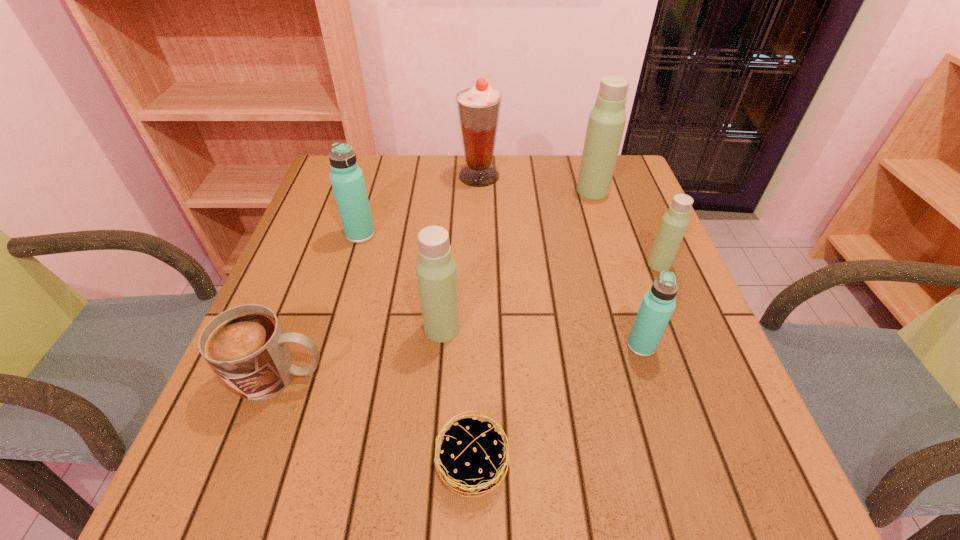
Locate an element on the screen. The height and width of the screenshot is (540, 960). the rightmost thermos bottle is located at coordinates (674, 223).

Where is `mug`? The image size is (960, 540). mug is located at coordinates (245, 346).

The height and width of the screenshot is (540, 960). Find the location of `the nearest object`. the nearest object is located at coordinates [x=471, y=458].

This screenshot has height=540, width=960. Identify the location of the shortest object. (471, 458).

The image size is (960, 540). Identify the location of vacant region located on the front of the second light thermos bottle from left to right. (616, 267).

Identify the location of vacant space located on the left of the red smoothie. (344, 176).

At what (x,y) coordinates should I click in order to perform the action: click on vacant point located 0.340m on the right of the left aqua thermos bottle. Please return your answer as a coordinate pair (x, y). The image size is (960, 540). Looking at the image, I should click on (514, 234).

Find the location of a particular element. The width and height of the screenshot is (960, 540). free point located on the left of the fourth thermos bottle from right to left is located at coordinates (333, 328).

Where is `vacant space positioned on the left of the nearer aqua thermos bottle`? vacant space positioned on the left of the nearer aqua thermos bottle is located at coordinates (549, 346).

Identify the location of free space located on the back of the smallest light thermos bottle. (626, 184).